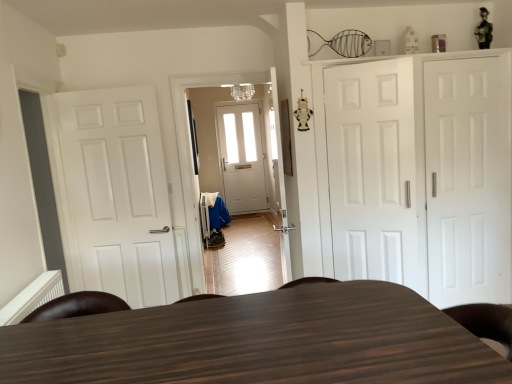
This screenshot has height=384, width=512. Identify the location of white matte door at left, acting as the first door starting from the left. (118, 193).

You are a GUI agent. You are given a task and a screenshot of the screen. Output one action in this format:
    pyautogui.click(x=<x>, y=<y>)
    Task: Click on the white matte door at center, arranged as the 2th door when viewed from the right
    The height and width of the screenshot is (384, 512).
    Given the screenshot: What is the action you would take?
    pyautogui.click(x=373, y=174)

I want to click on white matte door at right, the 1th door viewed from the right, so 468,179.

Describe the element at coordinates (468, 179) in the screenshot. Image resolution: width=512 pixels, height=384 pixels. I see `white matte door at right, arranged as the 3th door when viewed from the left` at that location.

What do you see at coordinates (259, 342) in the screenshot?
I see `dark wood table at center` at bounding box center [259, 342].

Image resolution: width=512 pixels, height=384 pixels. Find the location of `white matte door at left, acting as the first door starting from the left`. white matte door at left, acting as the first door starting from the left is located at coordinates (118, 193).

Is dark wood table at center facing towards white matte door at center, arranged as the 2th door when viewed from the right?

No.

Could white matte door at center, arranged as the 2th door when viewed from the right, be considered to be inside dark wood table at center?

Actually, white matte door at center, arranged as the 2th door when viewed from the right, is outside dark wood table at center.

How many degrees apart are the facing directions of dark wood table at center and white matte door at center, placed as the 2th door when sorted from left to right?

There is a 32-degree angle between the facing directions of dark wood table at center and white matte door at center, placed as the 2th door when sorted from left to right.

Is point (470, 373) closer or farther from the camera than point (389, 128)?

Point (470, 373).

The width and height of the screenshot is (512, 384). In order to click on the 2nd door behind the white matte door at center, placed as the 2th door when sorted from left to right in this screenshot , I will do `click(118, 193)`.

Is white matte door at left, which is counted as the 3th door, starting from the right, bigger than white matte door at center, arranged as the 2th door when viewed from the right?

Yes, white matte door at left, which is counted as the 3th door, starting from the right, is bigger than white matte door at center, arranged as the 2th door when viewed from the right.

Is white matte door at left, which is counted as the 3th door, starting from the right, positioned far away from white matte door at center, arranged as the 2th door when viewed from the right?

white matte door at left, which is counted as the 3th door, starting from the right, is far away from white matte door at center, arranged as the 2th door when viewed from the right.

Is point (338, 259) behind point (80, 345)?

Yes, it is.

Based on their positions, is white matte cabinet at right located to the left or right of dark wood table at center?

white matte cabinet at right is positioned on dark wood table at center's right side.

Is white matte cabinet at right far away from dark wood table at center?

Yes.

Which door is the 1st one when counting from the left side of the white matte cabinet at right? Please provide its 2D coordinates.

[(373, 174)]

Looking at their sizes, would you say white matte door at center, placed as the 2th door when sorted from left to right, is wider or thinner than white matte cabinet at right?

In the image, white matte door at center, placed as the 2th door when sorted from left to right, appears to be more narrow than white matte cabinet at right.

Do you think white matte door at center, placed as the 2th door when sorted from left to right, is within dark wood table at center, or outside of it?

white matte door at center, placed as the 2th door when sorted from left to right, lies outside dark wood table at center.

Are white matte door at center, placed as the 2th door when sorted from left to right, and dark wood table at center making contact?

No, white matte door at center, placed as the 2th door when sorted from left to right, is not beside dark wood table at center.

Does white matte door at center, placed as the 2th door when sorted from left to right, have a greater height compared to dark wood table at center?

Yes.

Which is less distant, (400, 63) or (140, 369)?

Point (400, 63).

From a real-world perspective, is white matte cabinet at right physically below white matte door at center, arranged as the 2th door when viewed from the right?

Yes, from a real-world perspective, white matte cabinet at right is beneath white matte door at center, arranged as the 2th door when viewed from the right.

From the image's perspective, is white matte cabinet at right over white matte door at center, placed as the 2th door when sorted from left to right?

No, from the image's perspective, white matte cabinet at right is not above white matte door at center, placed as the 2th door when sorted from left to right.

Is white matte cabinet at right next to white matte door at center, arranged as the 2th door when viewed from the right?

No, white matte cabinet at right is not in contact with white matte door at center, arranged as the 2th door when viewed from the right.

Can you confirm if white matte cabinet at right is shorter than white matte door at center, placed as the 2th door when sorted from left to right?

In fact, white matte cabinet at right may be taller than white matte door at center, placed as the 2th door when sorted from left to right.

Considering the sizes of white matte door at center, placed as the 2th door when sorted from left to right, and white matte door at left, which is counted as the 3th door, starting from the right, in the image, is white matte door at center, placed as the 2th door when sorted from left to right, bigger or smaller than white matte door at left, which is counted as the 3th door, starting from the right,?

Considering their sizes, white matte door at center, placed as the 2th door when sorted from left to right, takes up less space than white matte door at left, which is counted as the 3th door, starting from the right.

Would you consider white matte door at center, arranged as the 2th door when viewed from the right, to be distant from white matte door at left, which is counted as the 3th door, starting from the right?

That's right, there is a large distance between white matte door at center, arranged as the 2th door when viewed from the right, and white matte door at left, which is counted as the 3th door, starting from the right.

Considering the points (344, 104) and (99, 190), which point is behind, point (344, 104) or point (99, 190)?

The point (99, 190) is farther from the camera.

From the image's perspective, is white matte door at center, placed as the 2th door when sorted from left to right, located beneath white matte door at left, which is counted as the 3th door, starting from the right?

No, from the image's perspective, white matte door at center, placed as the 2th door when sorted from left to right, is not beneath white matte door at left, which is counted as the 3th door, starting from the right.

Where is `the 1st door behind when counting from the dark wood table at center`? The width and height of the screenshot is (512, 384). the 1st door behind when counting from the dark wood table at center is located at coordinates (373, 174).

I want to click on door located on the left of white matte door at center, placed as the 2th door when sorted from left to right, so click(118, 193).

Estimate the real-world distances between objects in this image. Which object is further from white matte cabinet at right, white matte door at left, acting as the first door starting from the left, or white matte door at center, arranged as the 2th door when viewed from the right?

white matte door at left, acting as the first door starting from the left, is further to white matte cabinet at right.

Based on their spatial positions, is white matte door at right, arranged as the 3th door when viewed from the left, or white matte door at left, which is counted as the 3th door, starting from the right, closer to white matte cabinet at right?

white matte door at right, arranged as the 3th door when viewed from the left.

Based on the photo, from the image, which object appears to be farther from dark wood table at center, white matte door at right, arranged as the 3th door when viewed from the left, or white matte door at center, placed as the 2th door when sorted from left to right?

white matte door at right, arranged as the 3th door when viewed from the left, is further to dark wood table at center.

Which object lies further to the anchor point dark wood table at center, white matte cabinet at right or white matte door at left, acting as the first door starting from the left?

Based on the image, white matte door at left, acting as the first door starting from the left, appears to be further to dark wood table at center.

When comparing their distances from white matte door at center, arranged as the 2th door when viewed from the right, does white matte door at left, acting as the first door starting from the left, or dark wood table at center seem further?

The object further to white matte door at center, arranged as the 2th door when viewed from the right, is dark wood table at center.

Based on their spatial positions, is white matte cabinet at right or dark wood table at center further from white matte door at center, arranged as the 2th door when viewed from the right?

Among the two, dark wood table at center is located further to white matte door at center, arranged as the 2th door when viewed from the right.

When comparing their distances from white matte door at center, arranged as the 2th door when viewed from the right, does dark wood table at center or white matte cabinet at right seem further?

dark wood table at center is further to white matte door at center, arranged as the 2th door when viewed from the right.

Looking at the image, which one is located further to white matte door at left, acting as the first door starting from the left, white matte door at right, arranged as the 3th door when viewed from the left, or dark wood table at center?

Based on the image, white matte door at right, arranged as the 3th door when viewed from the left, appears to be further to white matte door at left, acting as the first door starting from the left.

Identify the location of table between white matte door at left, which is counted as the 3th door, starting from the right, and white matte door at right, the 1th door viewed from the right, from left to right. This screenshot has width=512, height=384. (259, 342).

At what (x,y) coordinates should I click in order to perform the action: click on door positioned between dark wood table at center and white matte cabinet at right from near to far. Please return your answer as a coordinate pair (x, y). Looking at the image, I should click on (373, 174).

Locate an element on the screen. Image resolution: width=512 pixels, height=384 pixels. cabinetry between dark wood table at center and white matte door at right, arranged as the 3th door when viewed from the left, from front to back is located at coordinates (418, 173).

Find the location of a particular element. This screenshot has height=384, width=512. door situated between white matte door at left, acting as the first door starting from the left, and white matte cabinet at right from left to right is located at coordinates (373, 174).